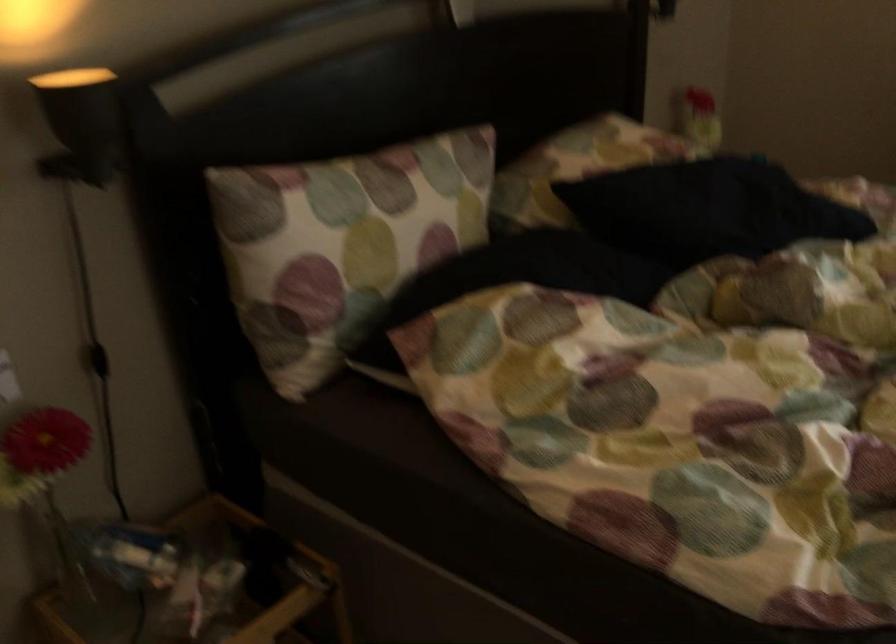
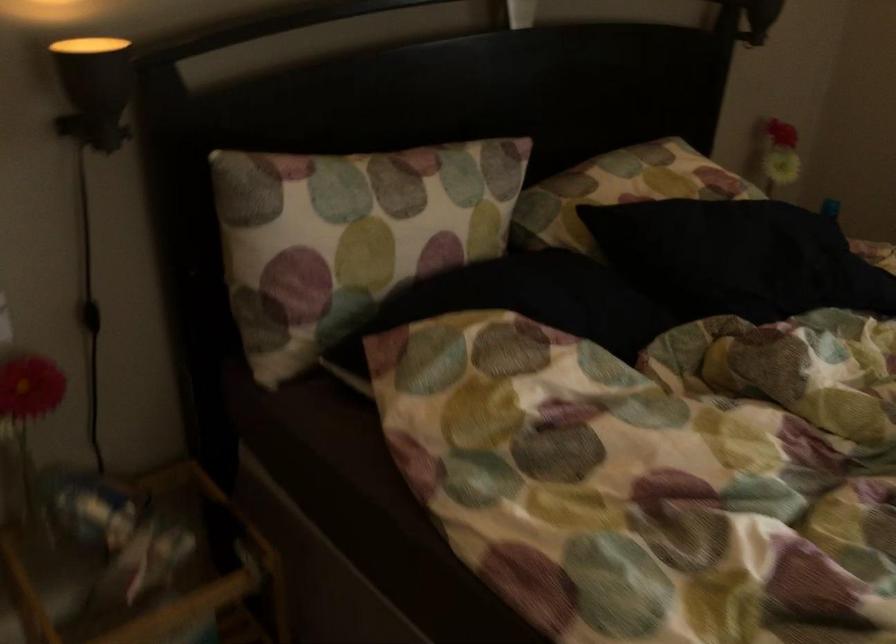
Locate, in the second image, the point that corresponds to (602,149) in the first image.

(649, 176)